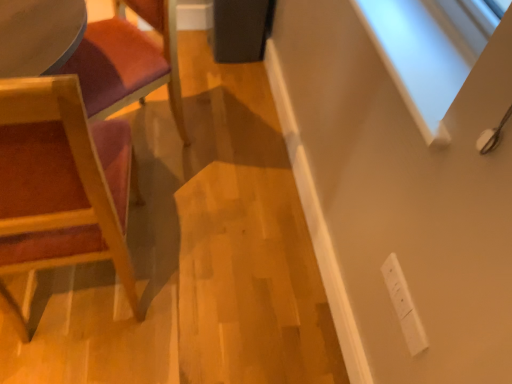
This screenshot has width=512, height=384. Find the location of `wooden chair at left, arranged as the 1th chair when ordered from the bottom`. wooden chair at left, arranged as the 1th chair when ordered from the bottom is located at coordinates (62, 181).

What do you see at coordinates (404, 305) in the screenshot? I see `white plastic electric outlet at lower right` at bounding box center [404, 305].

Locate an element on the screen. wooden chair at left, arranged as the 1th chair when ordered from the bottom is located at coordinates (62, 181).

From the image's perspective, which one is positioned higher, wooden chair at left, which is counted as the second chair, starting from the top, or white plastic electric outlet at lower right?

wooden chair at left, which is counted as the second chair, starting from the top, appears higher in the image.

Based on the photo, could you tell me if wooden chair at left, which is counted as the second chair, starting from the top, is turned towards white plastic electric outlet at lower right?

No, wooden chair at left, which is counted as the second chair, starting from the top, is not oriented towards white plastic electric outlet at lower right.

From a real-world perspective, is wooden chair at left, arranged as the 1th chair when ordered from the bottom, on white plastic electric outlet at lower right?

Correct, in the physical world, wooden chair at left, arranged as the 1th chair when ordered from the bottom, is higher than white plastic electric outlet at lower right.

Considering the positions of objects wooden chair at left, which is counted as the second chair, starting from the top, and white plastic electric outlet at lower right in the image provided, who is more to the right, wooden chair at left, which is counted as the second chair, starting from the top, or white plastic electric outlet at lower right?

From the viewer's perspective, white plastic electric outlet at lower right appears more on the right side.

In the scene shown: From a real-world perspective, relative to wooden chair at left, the 2th chair ordered from the bottom, is wooden chair at left, arranged as the 1th chair when ordered from the bottom, vertically above or below?

wooden chair at left, arranged as the 1th chair when ordered from the bottom, is situated higher than wooden chair at left, the 2th chair ordered from the bottom, in the real world.

In the image, is wooden chair at left, which is counted as the second chair, starting from the top, on the left side or the right side of wooden chair at left, the 2th chair ordered from the bottom?

Based on their positions, wooden chair at left, which is counted as the second chair, starting from the top, is located to the left of wooden chair at left, the 2th chair ordered from the bottom.

Does point (92, 190) come in front of point (89, 54)?

Yes, it is.

Is wooden chair at left, arranged as the 1th chair when ordered from the bottom, thinner than wooden chair at left, marked as the 1th chair in a top-to-bottom arrangement?

Correct, the width of wooden chair at left, arranged as the 1th chair when ordered from the bottom, is less than that of wooden chair at left, marked as the 1th chair in a top-to-bottom arrangement.

Between wooden chair at left, the 2th chair ordered from the bottom, and white plastic electric outlet at lower right, which one has less height?

Standing shorter between the two is white plastic electric outlet at lower right.

Does wooden chair at left, marked as the 1th chair in a top-to-bottom arrangement, appear on the left side of white plastic electric outlet at lower right?

Yes, wooden chair at left, marked as the 1th chair in a top-to-bottom arrangement, is to the left of white plastic electric outlet at lower right.

Looking at their sizes, would you say wooden chair at left, the 2th chair ordered from the bottom, is wider or thinner than white plastic electric outlet at lower right?

In the image, wooden chair at left, the 2th chair ordered from the bottom, appears to be wider than white plastic electric outlet at lower right.

Can you tell me how much wooden chair at left, the 2th chair ordered from the bottom, and white plastic electric outlet at lower right differ in facing direction?

32.6 degrees separate the facing orientations of wooden chair at left, the 2th chair ordered from the bottom, and white plastic electric outlet at lower right.

The width and height of the screenshot is (512, 384). In order to click on chair that is the 1st object to the left of the white plastic electric outlet at lower right, starting at the anchor in this screenshot , I will do `click(128, 62)`.

Consider the image. Which object is positioned more to the right, white plastic electric outlet at lower right or wooden chair at left, the 2th chair ordered from the bottom?

Positioned to the right is white plastic electric outlet at lower right.

From the image's perspective, does white plastic electric outlet at lower right appear lower than wooden chair at left, the 2th chair ordered from the bottom?

Yes, from the image's perspective, white plastic electric outlet at lower right is below wooden chair at left, the 2th chair ordered from the bottom.

Between white plastic electric outlet at lower right and wooden chair at left, which is counted as the second chair, starting from the top, which one appears on the right side from the viewer's perspective?

From the viewer's perspective, white plastic electric outlet at lower right appears more on the right side.

From the picture: Between white plastic electric outlet at lower right and wooden chair at left, which is counted as the second chair, starting from the top, which one has less height?

white plastic electric outlet at lower right.

Is white plastic electric outlet at lower right not close to wooden chair at left, which is counted as the second chair, starting from the top?

No.

Who is more distant, white plastic electric outlet at lower right or wooden chair at left, which is counted as the second chair, starting from the top?

white plastic electric outlet at lower right is further from the camera.

Does point (87, 90) appear closer or farther from the camera than point (80, 101)?

Point (87, 90) is farther from the camera than point (80, 101).

Between wooden chair at left, marked as the 1th chair in a top-to-bottom arrangement, and wooden chair at left, arranged as the 1th chair when ordered from the bottom, which one has smaller width?

wooden chair at left, arranged as the 1th chair when ordered from the bottom, is thinner.

From the image's perspective, which is above, wooden chair at left, the 2th chair ordered from the bottom, or wooden chair at left, which is counted as the second chair, starting from the top?

wooden chair at left, the 2th chair ordered from the bottom, appears higher in the image.

Is wooden chair at left, the 2th chair ordered from the bottom, in front of wooden chair at left, which is counted as the second chair, starting from the top?

No.

I want to click on electric outlet that appears below the wooden chair at left, arranged as the 1th chair when ordered from the bottom (from a real-world perspective), so click(x=404, y=305).

This screenshot has width=512, height=384. In the image, there is a wooden chair at left, arranged as the 1th chair when ordered from the bottom. Find the location of `chair above it (from the image's perspective)`. chair above it (from the image's perspective) is located at coordinates (128, 62).

Considering their positions, is wooden chair at left, arranged as the 1th chair when ordered from the bottom, positioned further to white plastic electric outlet at lower right than wooden chair at left, marked as the 1th chair in a top-to-bottom arrangement?

Among the two, wooden chair at left, marked as the 1th chair in a top-to-bottom arrangement, is located further to white plastic electric outlet at lower right.

Which object lies further to the anchor point wooden chair at left, which is counted as the second chair, starting from the top, wooden chair at left, marked as the 1th chair in a top-to-bottom arrangement, or white plastic electric outlet at lower right?

The object further to wooden chair at left, which is counted as the second chair, starting from the top, is white plastic electric outlet at lower right.

Consider the image. When comparing their distances from wooden chair at left, arranged as the 1th chair when ordered from the bottom, does white plastic electric outlet at lower right or wooden chair at left, the 2th chair ordered from the bottom, seem further?

Answer: white plastic electric outlet at lower right.

From the image, which object appears to be nearer to wooden chair at left, marked as the 1th chair in a top-to-bottom arrangement, wooden chair at left, arranged as the 1th chair when ordered from the bottom, or white plastic electric outlet at lower right?

wooden chair at left, arranged as the 1th chair when ordered from the bottom, is positioned closer to the anchor wooden chair at left, marked as the 1th chair in a top-to-bottom arrangement.

When comparing their distances from white plastic electric outlet at lower right, does wooden chair at left, marked as the 1th chair in a top-to-bottom arrangement, or wooden chair at left, which is counted as the second chair, starting from the top, seem further?

Based on the image, wooden chair at left, marked as the 1th chair in a top-to-bottom arrangement, appears to be further to white plastic electric outlet at lower right.

Which object lies further to the anchor point wooden chair at left, the 2th chair ordered from the bottom, white plastic electric outlet at lower right or wooden chair at left, arranged as the 1th chair when ordered from the bottom?

white plastic electric outlet at lower right is further to wooden chair at left, the 2th chair ordered from the bottom.

Image resolution: width=512 pixels, height=384 pixels. Find the location of `chair located between wooden chair at left, arranged as the 1th chair when ordered from the bottom, and white plastic electric outlet at lower right in the left-right direction`. chair located between wooden chair at left, arranged as the 1th chair when ordered from the bottom, and white plastic electric outlet at lower right in the left-right direction is located at coordinates (128, 62).